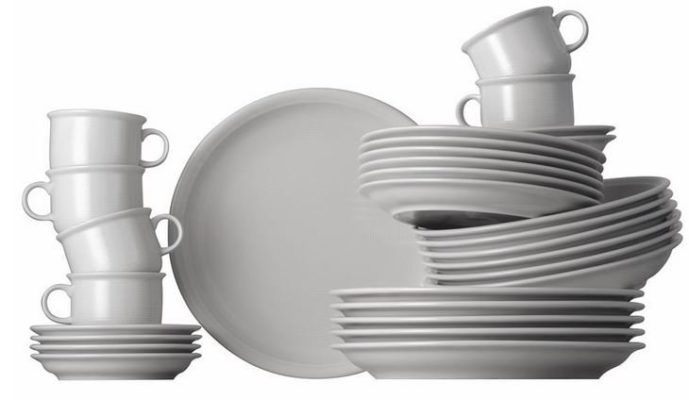
Image resolution: width=689 pixels, height=400 pixels. Find the location of `white cups`. white cups is located at coordinates (121, 306), (103, 239), (112, 181), (91, 118), (551, 101), (533, 50).